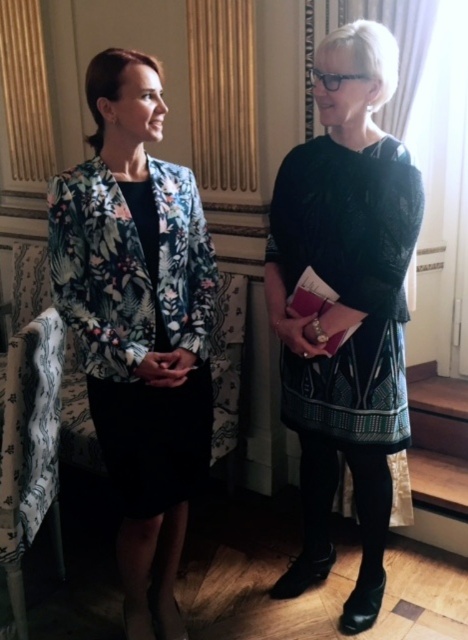
Consider the image. Who is more forward, [140,484] or [372,77]?

Point [372,77] is in front.

You are a GUI agent. You are given a task and a screenshot of the screen. Output one action in this format:
    pyautogui.click(x=<x>, y=<y>)
    Task: Click on the floral-patterned blazer at left
    This screenshot has height=640, width=468.
    Given the screenshot: What is the action you would take?
    pyautogui.click(x=138, y=324)

This screenshot has width=468, height=640. I want to click on floral-patterned blazer at left, so click(138, 324).

Consider the image. Does dark green textured dress at center have a greater height compared to patterned fabric armchair at lower left?

Correct, dark green textured dress at center is much taller as patterned fabric armchair at lower left.

The image size is (468, 640). Describe the element at coordinates (345, 305) in the screenshot. I see `dark green textured dress at center` at that location.

Identify the location of dark green textured dress at center. (345, 305).

The width and height of the screenshot is (468, 640). I want to click on dark green textured dress at center, so click(x=345, y=305).

Is floral-patterned blazer at left above patterned fabric armchair at lower left?

Yes, floral-patterned blazer at left is above patterned fabric armchair at lower left.

Can you confirm if floral-patterned blazer at left is positioned to the left of patterned fabric armchair at lower left?

In fact, floral-patterned blazer at left is to the right of patterned fabric armchair at lower left.

Who is more distant from viewer, (102,308) or (38,500)?

The point (38,500) is more distant.

What are the coordinates of `floral-patterned blazer at left` in the screenshot? It's located at (138, 324).